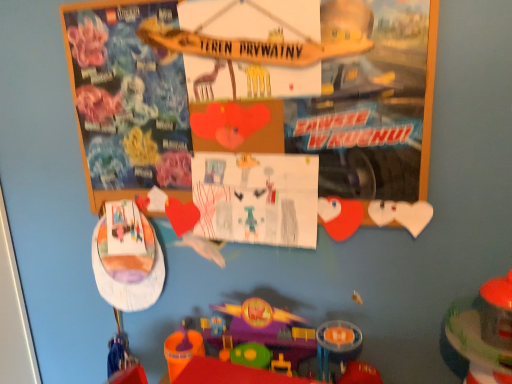
Question: Is colored paper drawing at center surrounded by matte plastic plate at left, the 3th toy positioned from the right?

Choices:
 (A) yes
 (B) no

Answer: (B)

Question: From the image's perspective, is matte plastic plate at left, the 3th toy positioned from the right, located above colored paper drawing at center?

Choices:
 (A) no
 (B) yes

Answer: (A)

Question: Does matte plastic plate at left, placed as the first toy when sorted from left to right, have a smaller size compared to colored paper drawing at center?

Choices:
 (A) yes
 (B) no

Answer: (B)

Question: Is matte plastic plate at left, the 3th toy positioned from the right, positioned with its back to colored paper drawing at center?

Choices:
 (A) yes
 (B) no

Answer: (B)

Question: Considering the relative sizes of matte plastic plate at left, the 3th toy positioned from the right, and colored paper drawing at center in the image provided, is matte plastic plate at left, the 3th toy positioned from the right, shorter than colored paper drawing at center?

Choices:
 (A) yes
 (B) no

Answer: (B)

Question: Does matte plastic plate at left, the 3th toy positioned from the right, have a larger size compared to colored paper drawing at center?

Choices:
 (A) yes
 (B) no

Answer: (A)

Question: Does wooden sign at upper center appear on the left side of matte plastic plate at left, the 3th toy positioned from the right?

Choices:
 (A) yes
 (B) no

Answer: (B)

Question: Could matte plastic plate at left, placed as the first toy when sorted from left to right, be considered to be inside wooden sign at upper center?

Choices:
 (A) no
 (B) yes

Answer: (A)

Question: From a real-world perspective, is wooden sign at upper center under matte plastic plate at left, placed as the first toy when sorted from left to right?

Choices:
 (A) yes
 (B) no

Answer: (B)

Question: From the image's perspective, is wooden sign at upper center located beneath matte plastic plate at left, placed as the first toy when sorted from left to right?

Choices:
 (A) yes
 (B) no

Answer: (B)

Question: Does wooden sign at upper center come behind matte plastic plate at left, the 3th toy positioned from the right?

Choices:
 (A) yes
 (B) no

Answer: (B)

Question: Is wooden sign at upper center positioned in front of matte plastic plate at left, the 3th toy positioned from the right?

Choices:
 (A) no
 (B) yes

Answer: (B)

Question: Is translucent plastic toy at lower right, placed as the third toy when sorted from left to right, beside matte plastic plate at left, the 3th toy positioned from the right?

Choices:
 (A) yes
 (B) no

Answer: (B)